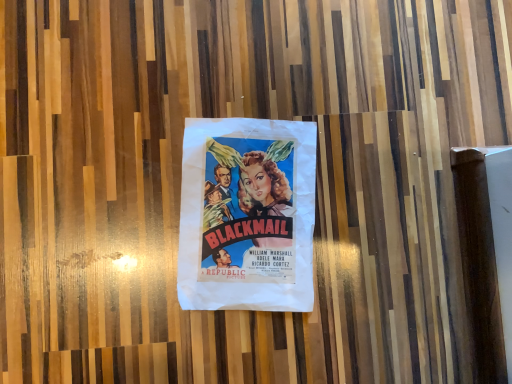
Where is `free space above matte paper poster at center (from a real-world perspective)`? This screenshot has width=512, height=384. free space above matte paper poster at center (from a real-world perspective) is located at coordinates (252, 218).